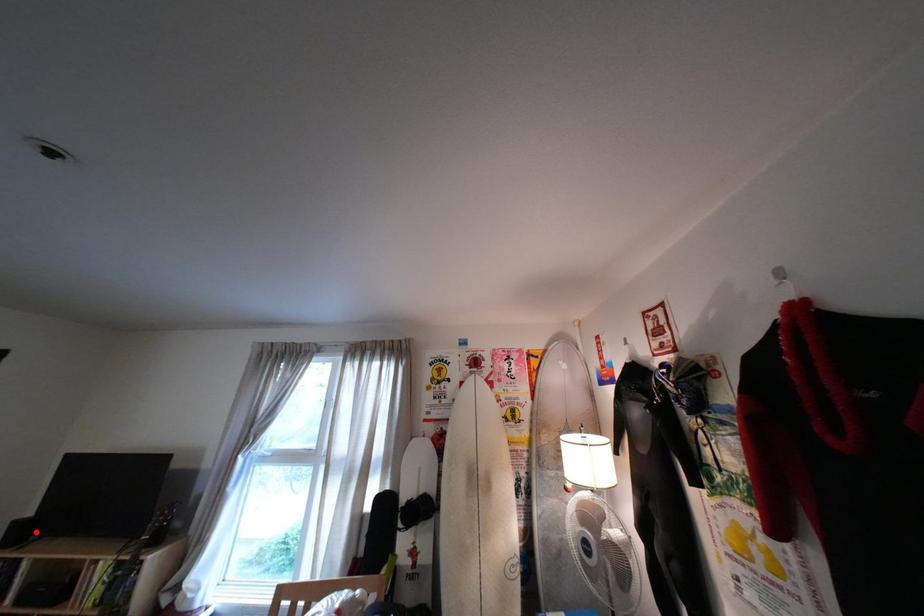
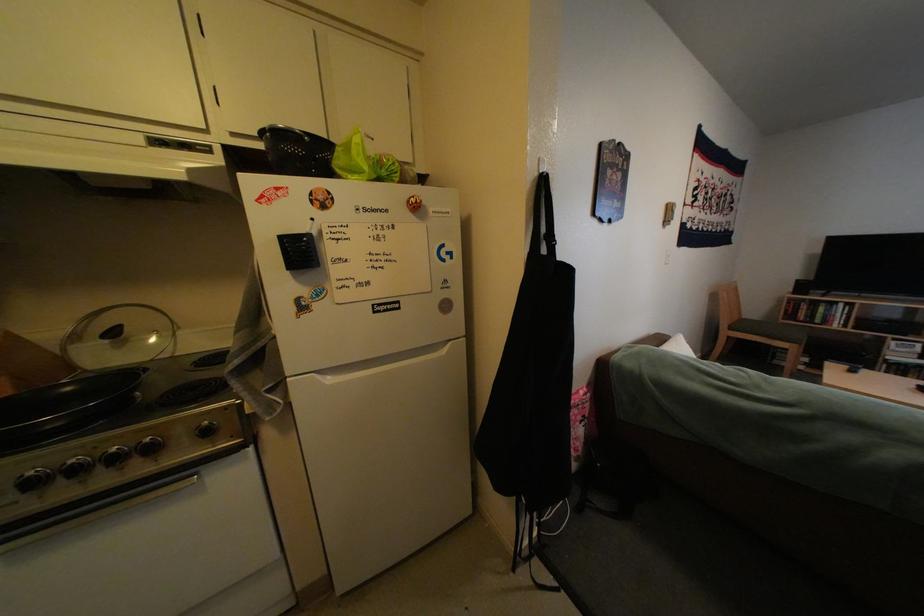
Question: I am providing you with two images of the same scene from different viewpoints. Image1 has a red point marked. In image2, the corresponding 3D location appears at what relative position? Reply with the corresponding letter.

Choices:
 (A) Closer
 (B) Farther

Answer: (B)